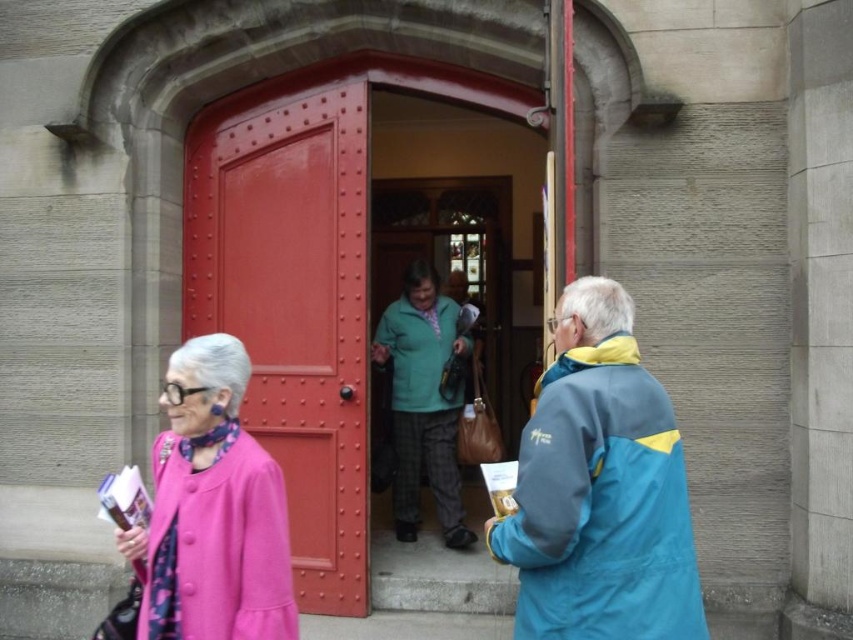
You are a tailor who needs to determine which coat requires more fabric to make between the teal fabric jacket at center and the pink woolen coat at left. Based on the image, which one would need more fabric?

The teal fabric jacket at center requires more fabric because it is bigger than the pink woolen coat at left.

You are standing at the red arched door and want to walk to the point marked as point (183, 216). There is an obstacle at point (619, 600). Will you pass in front of or behind the obstacle?

Since point (183, 216) is behind point (619, 600), you will pass behind the obstacle at point (619, 600) when walking to your destination.

You are standing at the entrance of the building and want to walk towards the point that is closer to the arched door. Which point should you head towards, point (531, 554) or point (537, 413)?

Point (531, 554) is in front of point (537, 413), so it is closer to the arched door. You should head towards point (531, 554).